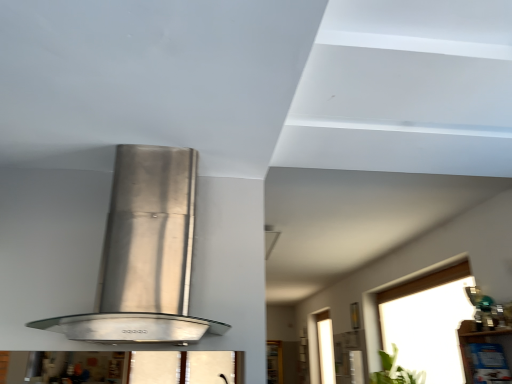
Question: Is clear glass window at upper right at the back of satin silver range hood at center?

Choices:
 (A) yes
 (B) no

Answer: (B)

Question: Could you tell me if satin silver range hood at center is turned towards clear glass window at upper right?

Choices:
 (A) no
 (B) yes

Answer: (A)

Question: From the image's perspective, is satin silver range hood at center under clear glass window at upper right?

Choices:
 (A) no
 (B) yes

Answer: (A)

Question: Is clear glass window at upper right located within satin silver range hood at center?

Choices:
 (A) yes
 (B) no

Answer: (B)

Question: Is satin silver range hood at center wider than clear glass window at upper right?

Choices:
 (A) yes
 (B) no

Answer: (A)

Question: Is point (143, 193) closer or farther from the camera than point (417, 380)?

Choices:
 (A) farther
 (B) closer

Answer: (B)

Question: From a real-world perspective, is satin silver range hood at center above or below green leafy plant at lower right?

Choices:
 (A) above
 (B) below

Answer: (A)

Question: Looking at the image, does satin silver range hood at center seem bigger or smaller compared to green leafy plant at lower right?

Choices:
 (A) big
 (B) small

Answer: (A)

Question: From the image's perspective, is satin silver range hood at center positioned above or below green leafy plant at lower right?

Choices:
 (A) above
 (B) below

Answer: (A)

Question: Is clear glass window at upper right inside or outside of satin silver range hood at center?

Choices:
 (A) inside
 (B) outside

Answer: (B)

Question: From their relative heights in the image, would you say clear glass window at upper right is taller or shorter than satin silver range hood at center?

Choices:
 (A) tall
 (B) short

Answer: (A)

Question: From a real-world perspective, is clear glass window at upper right physically located above or below satin silver range hood at center?

Choices:
 (A) below
 (B) above

Answer: (A)

Question: Is point pos(440,301) closer or farther from the camera than point pos(138,309)?

Choices:
 (A) farther
 (B) closer

Answer: (A)

Question: Is clear glass window at upper right inside or outside of green leafy plant at lower right?

Choices:
 (A) inside
 (B) outside

Answer: (B)

Question: Does point (433, 370) appear closer or farther from the camera than point (374, 380)?

Choices:
 (A) closer
 (B) farther

Answer: (A)